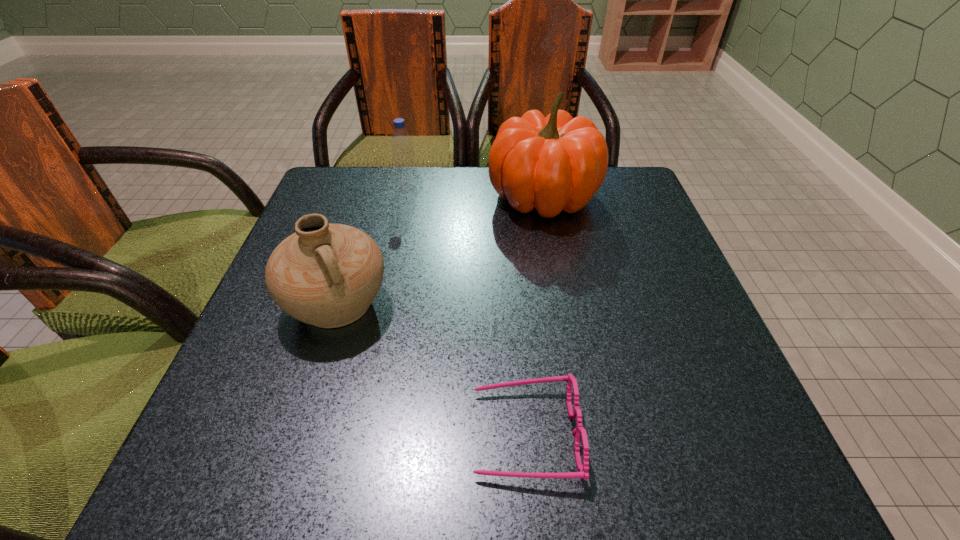
Locate an element on the screen. This screenshot has width=960, height=540. pumpkin is located at coordinates (553, 163).

This screenshot has width=960, height=540. Identify the location of the second nearest object. (327, 275).

Image resolution: width=960 pixels, height=540 pixels. Find the location of `bottle`. bottle is located at coordinates (405, 172).

This screenshot has width=960, height=540. Find the location of `the nearest object`. the nearest object is located at coordinates (583, 469).

The width and height of the screenshot is (960, 540). I want to click on the shortest object, so click(583, 469).

I want to click on vacant space located on the right of the pumpkin, so click(639, 197).

Find the location of a particular element. This screenshot has height=540, width=960. free space located on the back of the pottery is located at coordinates (366, 213).

Identify the location of free space located on the left of the bottle. The height and width of the screenshot is (540, 960). (332, 188).

Identify the location of vacant space located 0.050m on the arms of the spectacles. (439, 434).

Identify the location of vacant space located 0.200m on the arms of the spectacles. (335, 434).